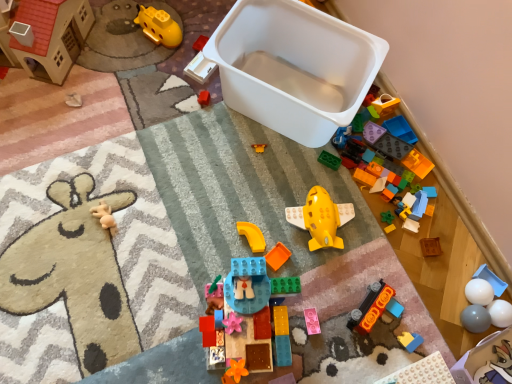
Find the location of a particular element. vacant space situated on the left part of translucent blue plastic building block at center, the 12th toy from the right is located at coordinates (166, 311).